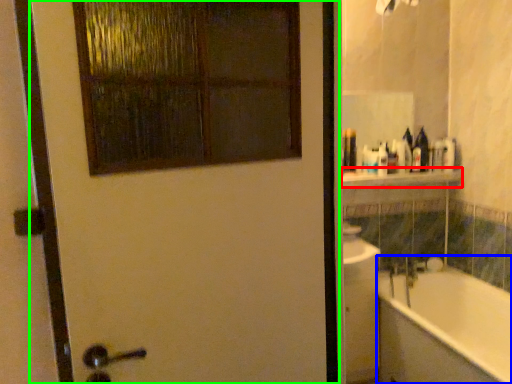
Question: Which object is the closest to the balustrade (highlighted by a red box)? Choose among these: bathtub (highlighted by a blue box) or door (highlighted by a green box).

Choices:
 (A) bathtub
 (B) door

Answer: (A)